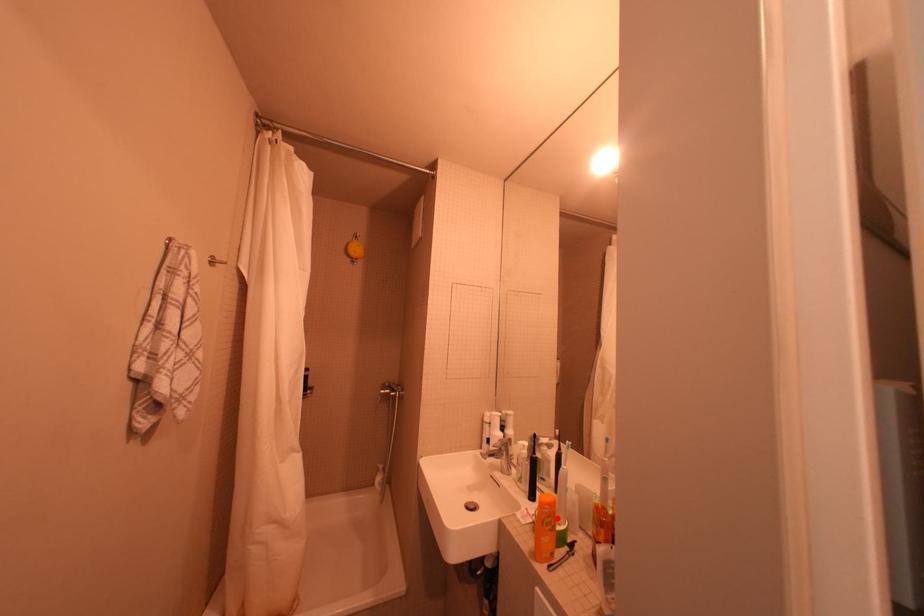
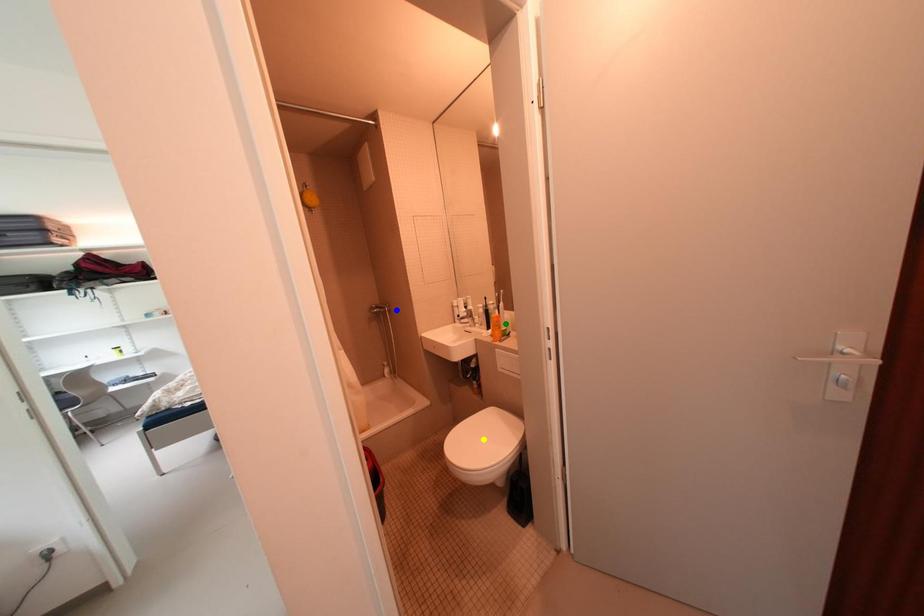
Question: I am providing you with two images of the same scene from different viewpoints. A red point is marked on the first image. You are given multiple points on the second image. Which spot in image 2 lines up with the point in image 1?

Choices:
 (A) blue point
 (B) green point
 (C) yellow point

Answer: (B)